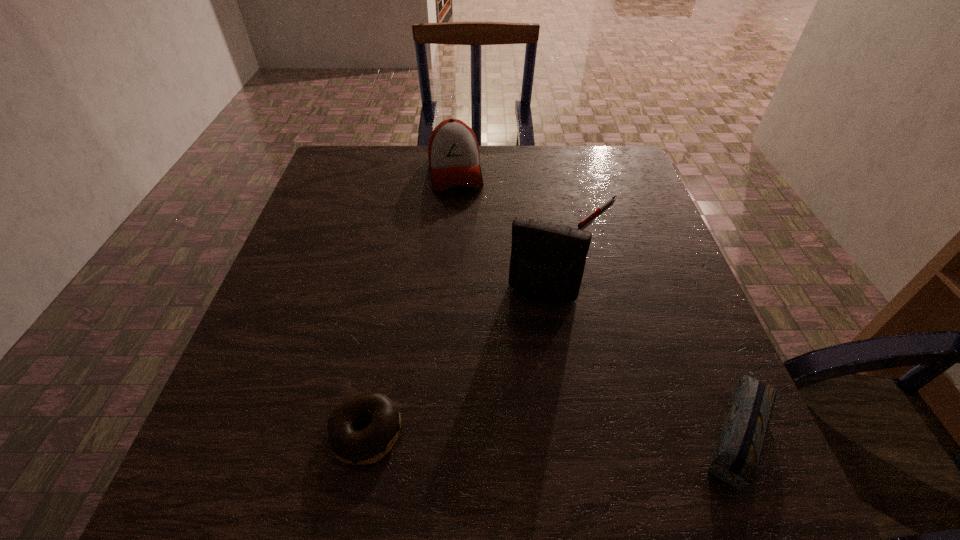
The height and width of the screenshot is (540, 960). Identify the location of free point that satisfies the following two spatial constraints: 1. on the back side of the baseball cap; 2. on the left side of the doughnut. (415, 172).

Identify the location of free space that satisfies the following two spatial constraints: 1. on the back side of the fourth tallest object; 2. on the left side of the pencil box. (367, 427).